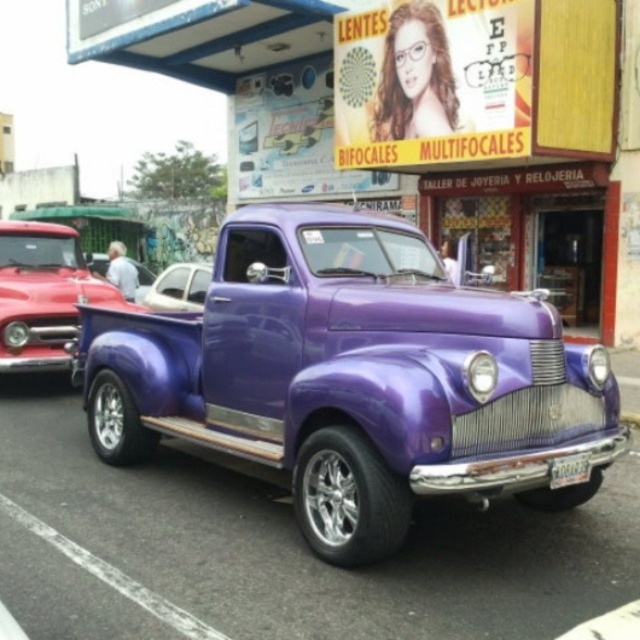
The width and height of the screenshot is (640, 640). Describe the element at coordinates (355, 378) in the screenshot. I see `shiny purple truck at center` at that location.

The height and width of the screenshot is (640, 640). What do you see at coordinates (355, 378) in the screenshot?
I see `shiny purple truck at center` at bounding box center [355, 378].

I want to click on shiny purple truck at center, so click(355, 378).

Does shiny red truck at left have a greater width compared to purple metallic truck at center?

Incorrect, shiny red truck at left's width does not surpass purple metallic truck at center's.

Who is more distant from viewer, (x=116, y=289) or (x=100, y=260)?

Point (x=100, y=260)

The image size is (640, 640). Find the location of `shiny red truck at left`. shiny red truck at left is located at coordinates (44, 294).

Is shiny purple truck at center thinner than purple metallic truck at center?

Correct, shiny purple truck at center's width is less than purple metallic truck at center's.

Between shiny purple truck at center and purple metallic truck at center, which one has more height?

shiny purple truck at center is taller.

The height and width of the screenshot is (640, 640). What do you see at coordinates (355, 378) in the screenshot? I see `shiny purple truck at center` at bounding box center [355, 378].

Where is `shiny purple truck at center`? shiny purple truck at center is located at coordinates (355, 378).